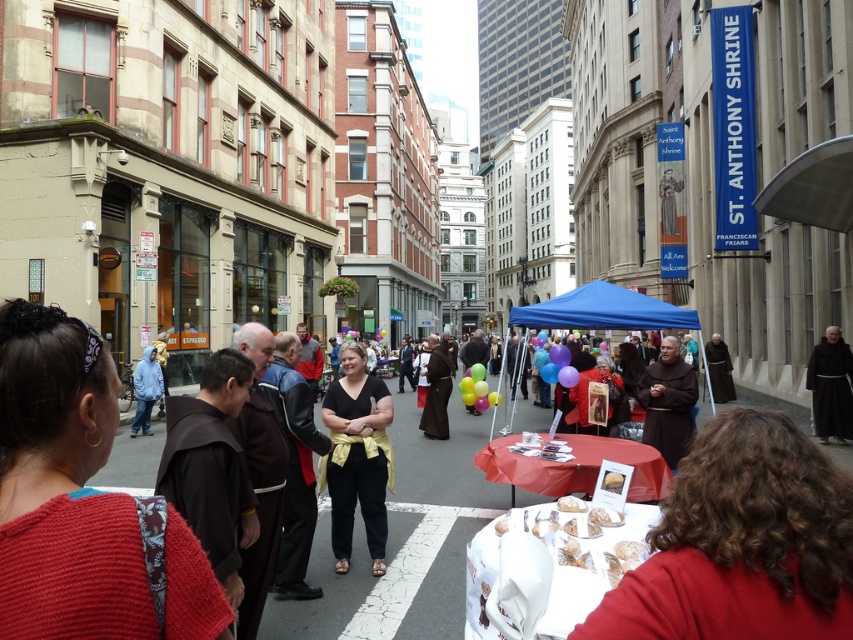
Can you confirm if white sugared donuts at lower center is bigger than blue fabric canopy at center?

Actually, white sugared donuts at lower center might be smaller than blue fabric canopy at center.

At what (x,y) coordinates should I click in order to perform the action: click on white sugared donuts at lower center. Please return your answer as a coordinate pair (x, y). The image size is (853, 640). Looking at the image, I should click on (589, 536).

At what (x,y) coordinates should I click in order to perform the action: click on white sugared donuts at lower center. Please return your answer as a coordinate pair (x, y). Looking at the image, I should click on (589, 536).

Looking at this image, between black matte shirt at center and blue fabric canopy at center, which one appears on the left side from the viewer's perspective?

black matte shirt at center is more to the left.

Does point (379, 422) come in front of point (544, 314)?

Yes, it is in front of point (544, 314).

Consider the image. Who is more forward, (357, 364) or (659, 307)?

Point (357, 364)

At what (x,y) coordinates should I click in order to perform the action: click on black matte shirt at center. Please return your answer as a coordinate pair (x, y). Looking at the image, I should click on (357, 456).

Between black matte shirt at center and white sugared donuts at lower center, which one has less height?

With less height is white sugared donuts at lower center.

Can you confirm if black matte shirt at center is bigger than white sugared donuts at lower center?

Indeed, black matte shirt at center has a larger size compared to white sugared donuts at lower center.

I want to click on black matte shirt at center, so click(357, 456).